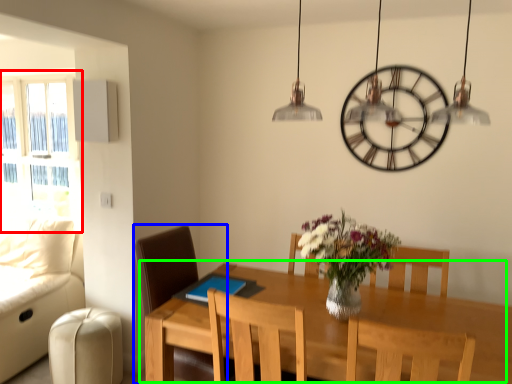
Question: Estimate the real-world distances between objects in this image. Which object is closer to window (highlighted by a red box), chair (highlighted by a blue box) or table (highlighted by a green box)?

Choices:
 (A) chair
 (B) table

Answer: (A)